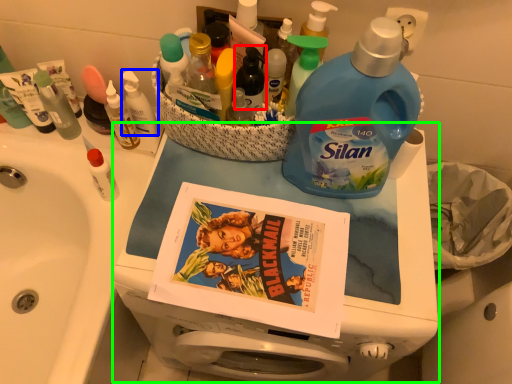
Question: Which object is the closest to the bottle (highlighted by a red box)? Choose among these: toiletry (highlighted by a blue box) or appliance (highlighted by a green box).

Choices:
 (A) toiletry
 (B) appliance

Answer: (A)